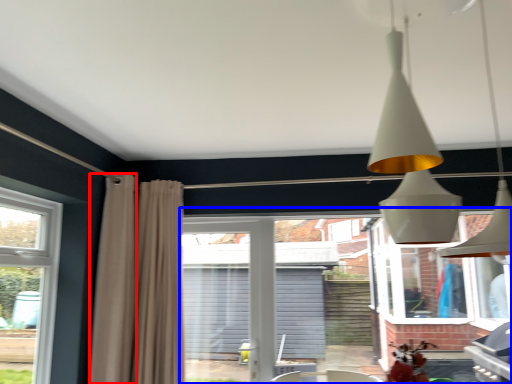
Question: Among these objects, which one is farthest to the camera, curtain (highlighted by a red box) or backyard (highlighted by a blue box)?

Choices:
 (A) curtain
 (B) backyard

Answer: (B)